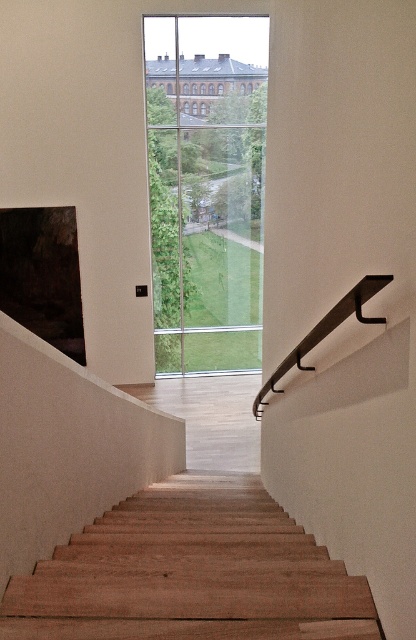
From the picture: Does wooden stairs at center have a greater height compared to black metal handrail at upper right?

Correct, wooden stairs at center is much taller as black metal handrail at upper right.

Identify the location of wooden stairs at center. Image resolution: width=416 pixels, height=640 pixels. (190, 573).

Between clear glass window at center and black metal handrail at upper right, which one appears on the left side from the viewer's perspective?

From the viewer's perspective, clear glass window at center appears more on the left side.

Which is behind, point (185, 275) or point (376, 284)?

Point (185, 275)

I want to click on clear glass window at center, so click(207, 189).

Can you confirm if wooden stairs at center is smaller than clear glass window at center?

Yes, wooden stairs at center is smaller than clear glass window at center.

Find the location of `wooden stairs at center`. wooden stairs at center is located at coordinates [190, 573].

Where is `wooden stairs at center`? wooden stairs at center is located at coordinates (190, 573).